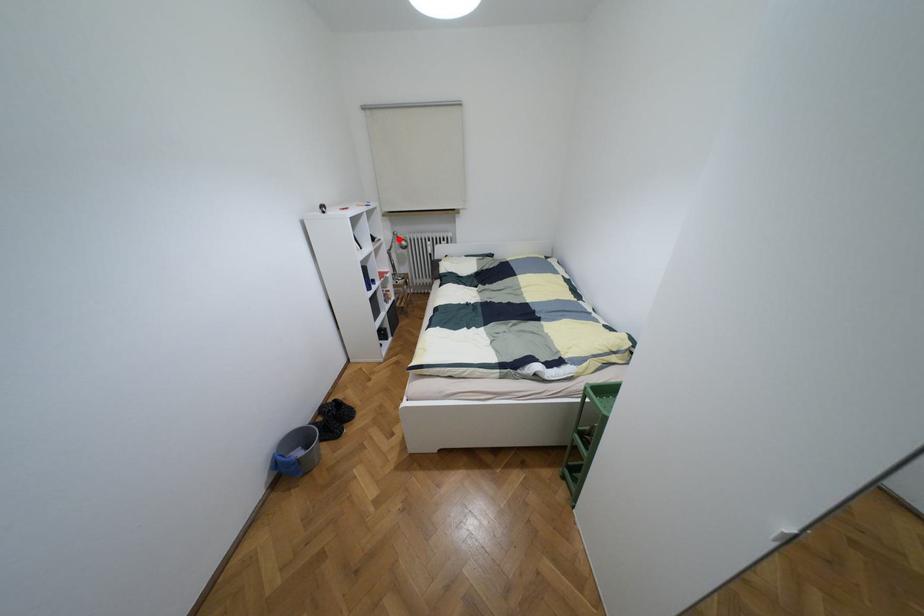
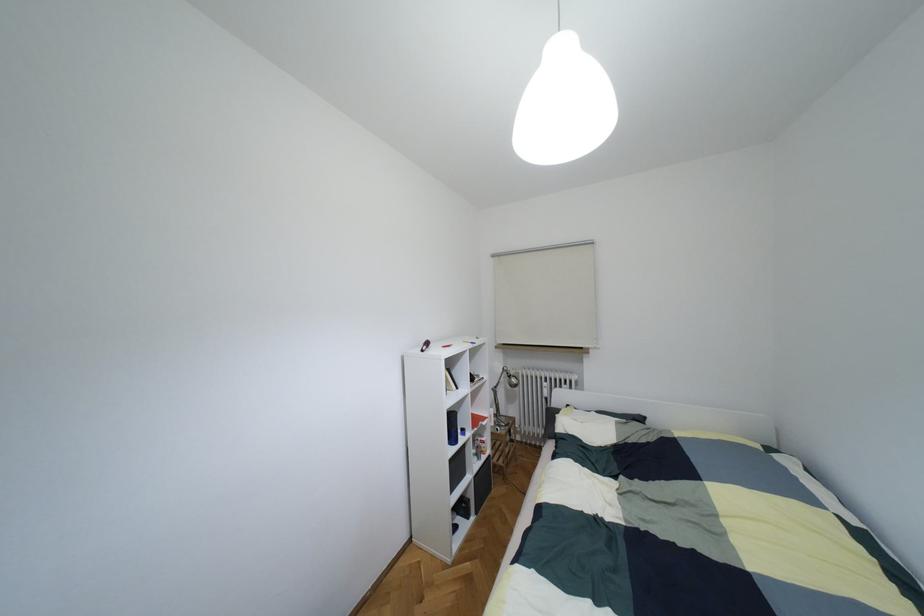
The point at the highlighted location is marked in the first image. Where is the corresponding point in the second image?

(508, 376)